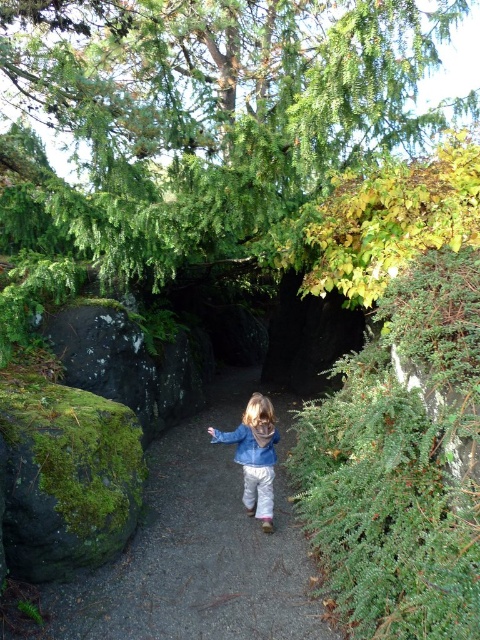
You are a hiker trying to take a photo of the green leafy tree at upper center and the denim jacket at center. Which object should you focus on first if you want to capture both in the same frame without moving the camera?

You should focus on the green leafy tree at upper center first because it is closer to you than the denim jacket at center, so adjusting the focus to it will ensure both are in the frame.

You are standing at the starting point of the pathway and want to reach the end. Which point, point (240,563) or point (264,451), is closer to you as you begin your walk?

Point (240,563) is closer to the viewer than point (264,451), so the closer point to you as you begin your walk is point (240,563).